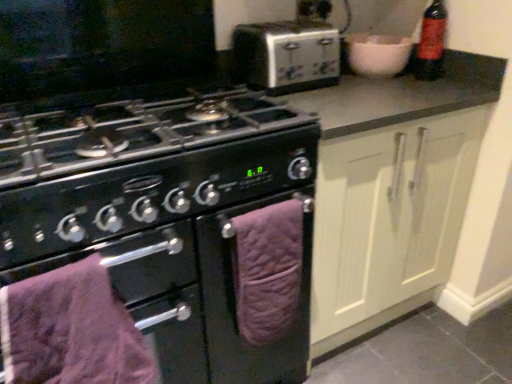
At what (x,y) coordinates should I click in order to perform the action: click on free space in front of red matte bottle at upper right. Please return your answer as a coordinate pair (x, y). The width and height of the screenshot is (512, 384). Looking at the image, I should click on (433, 91).